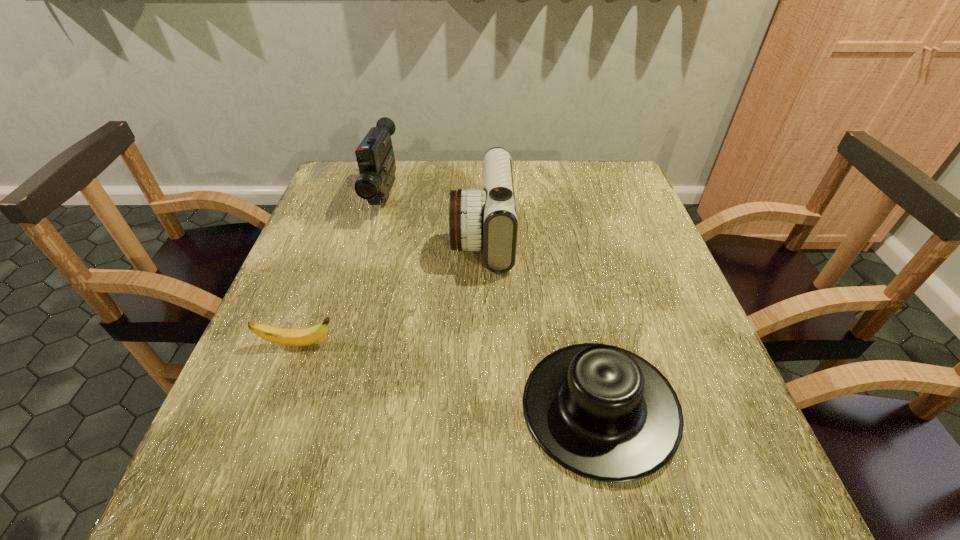
Identify the location of object that is at the near edge. Image resolution: width=960 pixels, height=540 pixels. (602, 412).

Where is `camcorder situated at the left edge`? camcorder situated at the left edge is located at coordinates (375, 157).

I want to click on banana positioned at the left edge, so click(292, 337).

At what (x,y) coordinates should I click in order to perform the action: click on object that is at the right edge. Please return your answer as a coordinate pair (x, y). The image size is (960, 540). Looking at the image, I should click on click(602, 412).

Find the location of a particular element. Image resolution: width=960 pixels, height=540 pixels. object located at the far left corner is located at coordinates (375, 157).

The image size is (960, 540). Identify the location of object that is positioned at the near right corner. (602, 412).

At what (x,y) coordinates should I click in order to perform the action: click on free region at the left edge. Please return your answer as a coordinate pair (x, y). Looking at the image, I should click on (331, 325).

At what (x,y) coordinates should I click in order to perform the action: click on vacant space at the right edge of the desktop. Please return your answer as a coordinate pair (x, y). Image resolution: width=960 pixels, height=540 pixels. Looking at the image, I should click on (624, 254).

In the image, there is a desktop. Where is `blank space at the far left corner`? blank space at the far left corner is located at coordinates (341, 173).

In the image, there is a desktop. What are the coordinates of `vacant space at the far right corner` in the screenshot? It's located at (625, 193).